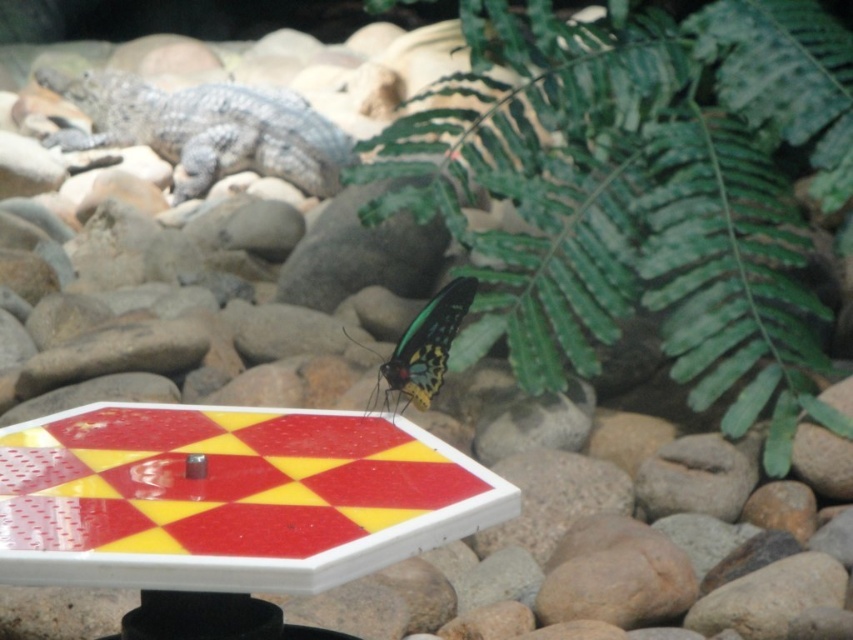
Does green leafy fern at upper right have a lesser height compared to gray textured crocodile at upper left?

No.

Find the location of a particular element. This screenshot has width=853, height=640. green leafy fern at upper right is located at coordinates (648, 192).

Locate an element on the screen. The image size is (853, 640). green leafy fern at upper right is located at coordinates (648, 192).

The image size is (853, 640). What do you see at coordinates (206, 129) in the screenshot?
I see `gray textured crocodile at upper left` at bounding box center [206, 129].

Does gray textured crocodile at upper left have a lesser height compared to shiny metallic butterfly at center?

In fact, gray textured crocodile at upper left may be taller than shiny metallic butterfly at center.

Find the location of `gray textured crocodile at upper left`. gray textured crocodile at upper left is located at coordinates (206, 129).

Does green leafy fern at upper right have a greater width compared to shiny metallic butterfly at center?

Indeed, green leafy fern at upper right has a greater width compared to shiny metallic butterfly at center.

Who is more forward, (833, 42) or (402, 380)?

Point (402, 380)

Identify the location of green leafy fern at upper right. (648, 192).